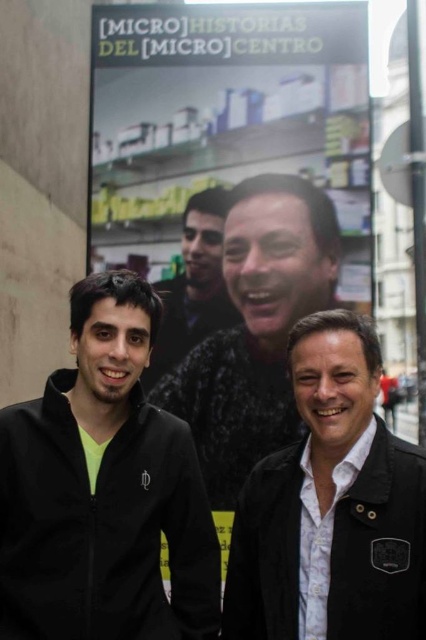
Which is more to the right, black matte jacket at left or black leather jacket at center?

From the viewer's perspective, black leather jacket at center appears more on the right side.

Between black matte jacket at left and black leather jacket at center, which one has more height?

With more height is black matte jacket at left.

Locate an element on the screen. black matte jacket at left is located at coordinates (103, 490).

Locate an element on the screen. The image size is (426, 640). black matte jacket at left is located at coordinates (103, 490).

Between matte plastic poster at upper center and smooth black jacket at center, which one has more height?

matte plastic poster at upper center is taller.

The height and width of the screenshot is (640, 426). Describe the element at coordinates (226, 116) in the screenshot. I see `matte plastic poster at upper center` at that location.

At what (x,y) coordinates should I click in order to perform the action: click on matte plastic poster at upper center. Please return your answer as a coordinate pair (x, y). Image resolution: width=426 pixels, height=640 pixels. Looking at the image, I should click on (226, 116).

Who is positioned more to the right, black matte jacket at left or matte black jacket at center?

From the viewer's perspective, matte black jacket at center appears more on the right side.

Does black matte jacket at left have a lesser width compared to matte black jacket at center?

Incorrect, black matte jacket at left's width is not less than matte black jacket at center's.

Between point (123, 531) and point (271, 205), which one is positioned behind?

Positioned behind is point (271, 205).

The width and height of the screenshot is (426, 640). In order to click on black matte jacket at left in this screenshot , I will do `click(103, 490)`.